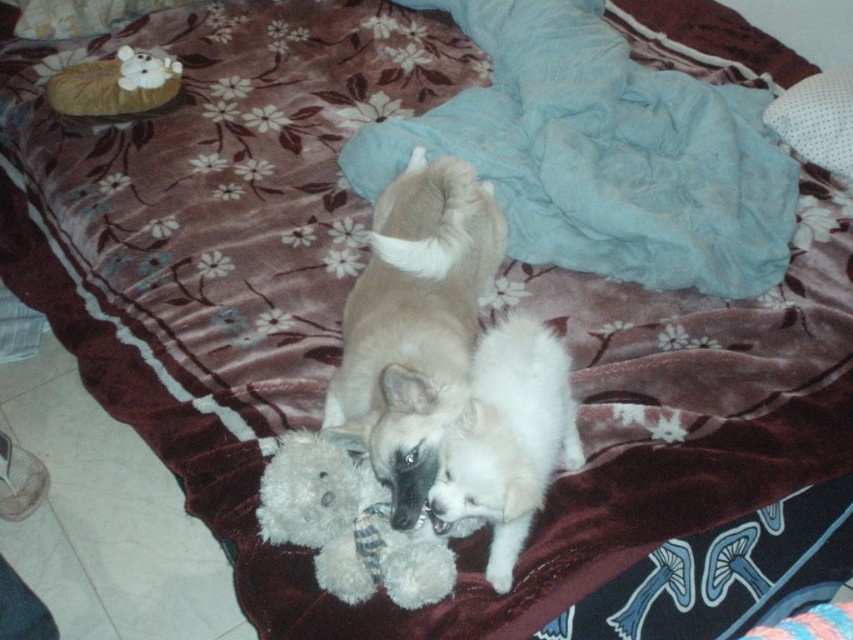
Does white fur dog at center have a greater width compared to white dotted pillow at upper right?

Yes, white fur dog at center is wider than white dotted pillow at upper right.

This screenshot has height=640, width=853. I want to click on white fur dog at center, so click(415, 323).

Locate an element on the screen. white fur dog at center is located at coordinates (415, 323).

Can you confirm if white fluffy dog at center is positioned to the left of white plush teddy bear at center?

In fact, white fluffy dog at center is to the right of white plush teddy bear at center.

Identify the location of white fluffy dog at center. (508, 436).

Is point (323, 522) positioned after point (834, 81)?

No, (323, 522) is in front of (834, 81).

Which is above, white plush teddy bear at center or white dotted pillow at upper right?

white dotted pillow at upper right

Locate an element on the screen. The width and height of the screenshot is (853, 640). white plush teddy bear at center is located at coordinates (347, 524).

Identify the location of white plush teddy bear at center. The image size is (853, 640). (347, 524).